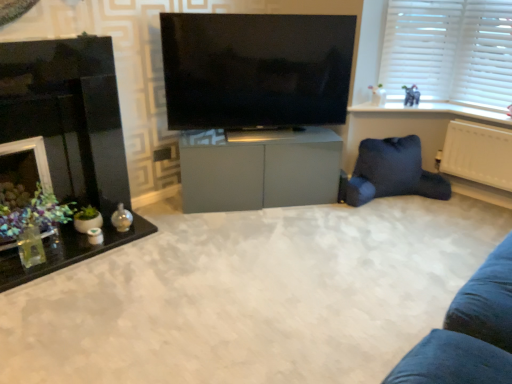
I want to click on vacant space in front of matte gray cabinet at center, so click(x=255, y=247).